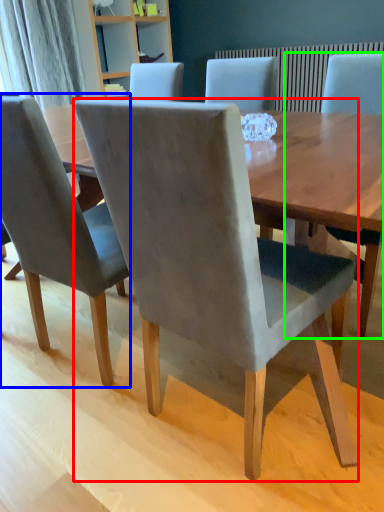
Question: Estimate the real-world distances between objects in this image. Which object is farther from chair (highlighted by a red box), chair (highlighted by a blue box) or chair (highlighted by a green box)?

Choices:
 (A) chair
 (B) chair

Answer: (B)